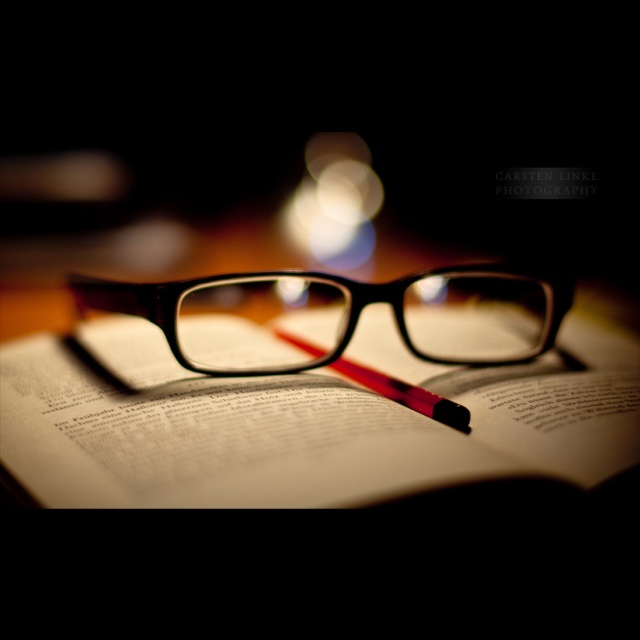
Can you confirm if paper book at center is positioned below red rubberized pencil at center?

No, paper book at center is not below red rubberized pencil at center.

Which of these two, paper book at center or red rubberized pencil at center, stands shorter?

Standing shorter between the two is red rubberized pencil at center.

Who is more distant from viewer, (452, 429) or (408, 403)?

The point (408, 403) is behind.

The width and height of the screenshot is (640, 640). In order to click on paper book at center in this screenshot , I will do `click(301, 420)`.

The image size is (640, 640). Describe the element at coordinates (301, 420) in the screenshot. I see `paper book at center` at that location.

Is point (308, 449) farther from camera compared to point (467, 348)?

No.

Find the location of a particular element. The image size is (640, 640). paper book at center is located at coordinates (301, 420).

Can you confirm if black plastic glasses at center is taller than red rubberized pencil at center?

Yes.

Is point (429, 316) farther from viewer compared to point (444, 400)?

That is True.

Locate an element on the screen. black plastic glasses at center is located at coordinates (340, 316).